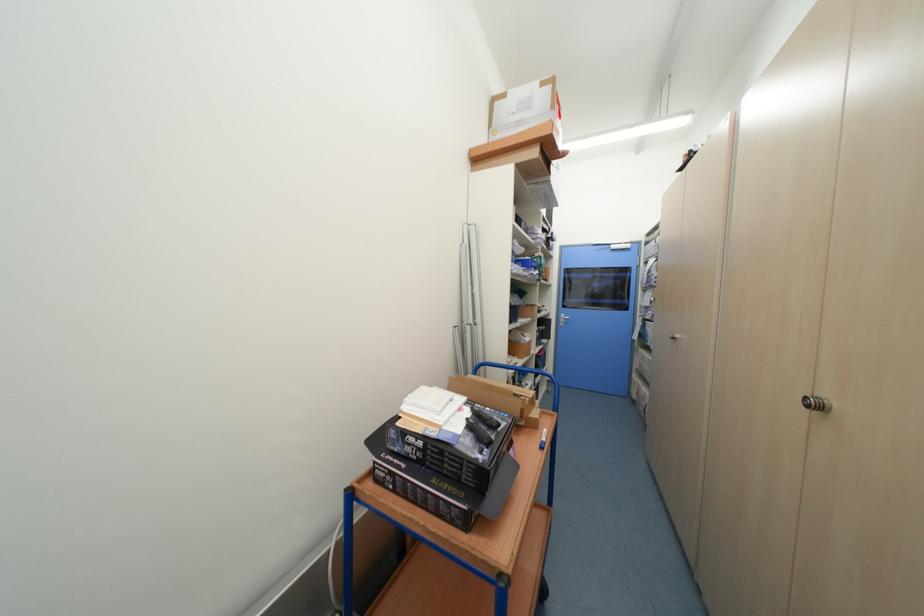
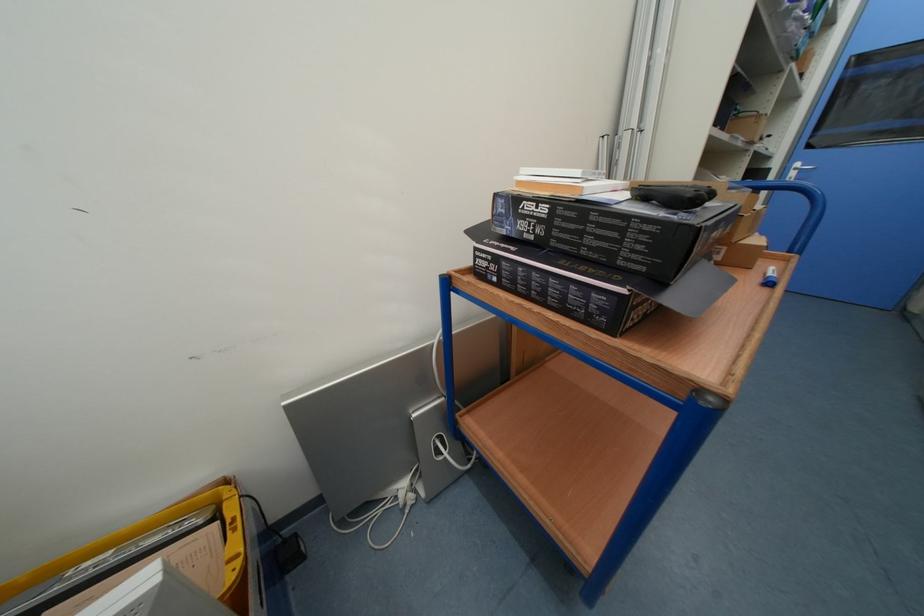
Where in the second image is the point corresponding to the point at 416,446 from the first image?

(530, 217)